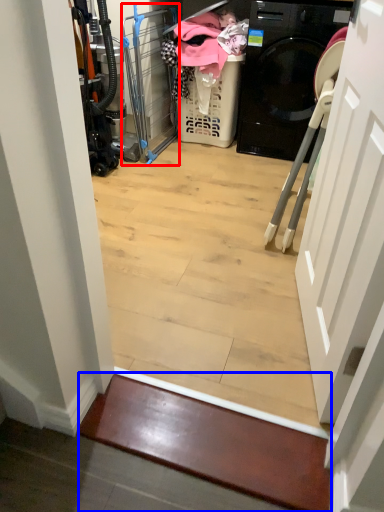
Question: Which point is closer to the camera, screen door (highlighted by a red box) or stairwell (highlighted by a blue box)?

Choices:
 (A) screen door
 (B) stairwell

Answer: (B)